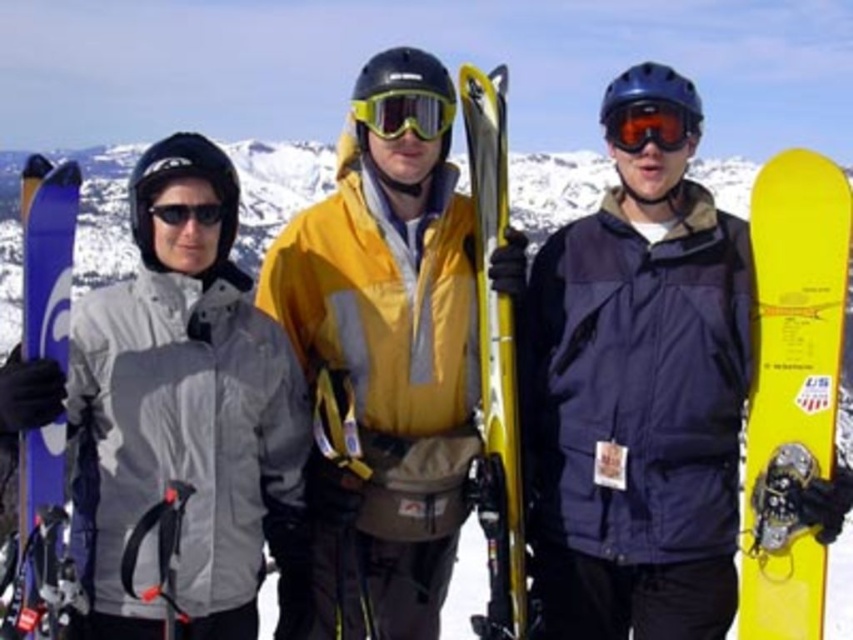
Which is behind, point (814, 317) or point (444, 125)?

The point (444, 125) is more distant.

What do you see at coordinates (791, 387) in the screenshot? I see `yellow matte snowboard at right` at bounding box center [791, 387].

At what (x,y) coordinates should I click in order to perform the action: click on yellow matte snowboard at right. Please return your answer as a coordinate pair (x, y). The image size is (853, 640). Looking at the image, I should click on (791, 387).

Is blue matte ski at left shorter than orange reflective goggles at center?

In fact, blue matte ski at left may be taller than orange reflective goggles at center.

Is blue matte ski at left taller than orange reflective goggles at center?

Correct, blue matte ski at left is much taller as orange reflective goggles at center.

Find the location of a particular element. blue matte ski at left is located at coordinates [x=47, y=256].

Which is below, yellow matte ski at center or yellow metallic ski at center?

Positioned lower is yellow metallic ski at center.

Does yellow matte ski at center have a larger size compared to yellow metallic ski at center?

Yes.

Which is behind, point (432, 90) or point (492, 200)?

Positioned behind is point (432, 90).

You are a GUI agent. You are given a task and a screenshot of the screen. Output one action in this format:
    pyautogui.click(x=<x>, y=<y>)
    Task: Click on the yellow matte ski at center
    
    Given the screenshot: What is the action you would take?
    pyautogui.click(x=383, y=380)